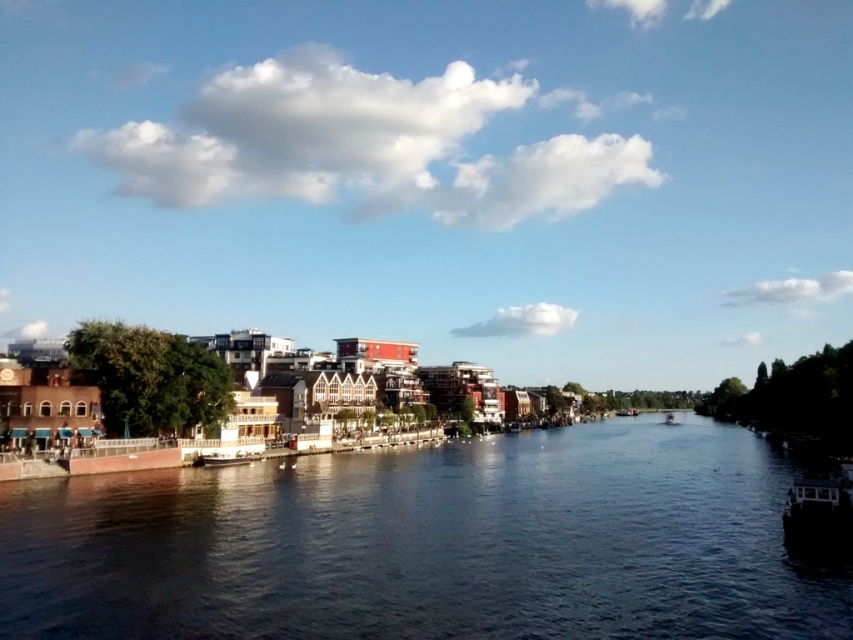
Question: Which object is farther from the camera taking this photo?

Choices:
 (A) white plastic boat at center
 (B) metallic silver boat at lower right

Answer: (A)

Question: Observing the image, what is the correct spatial positioning of metallic silver boat at lower right in reference to white plastic boat at center?

Choices:
 (A) below
 (B) above

Answer: (B)

Question: Which point is closer to the camera?

Choices:
 (A) (844, 525)
 (B) (605, 604)

Answer: (B)

Question: Among these objects, which one is farthest from the camera?

Choices:
 (A) white plastic boat at center
 (B) dark blue water at center
 (C) metallic silver boat at lower right

Answer: (A)

Question: Does metallic silver boat at lower right appear on the right side of white plastic boat at center?

Choices:
 (A) no
 (B) yes

Answer: (A)

Question: From the image, what is the correct spatial relationship of dark blue water at center in relation to white plastic boat at center?

Choices:
 (A) above
 (B) below

Answer: (A)